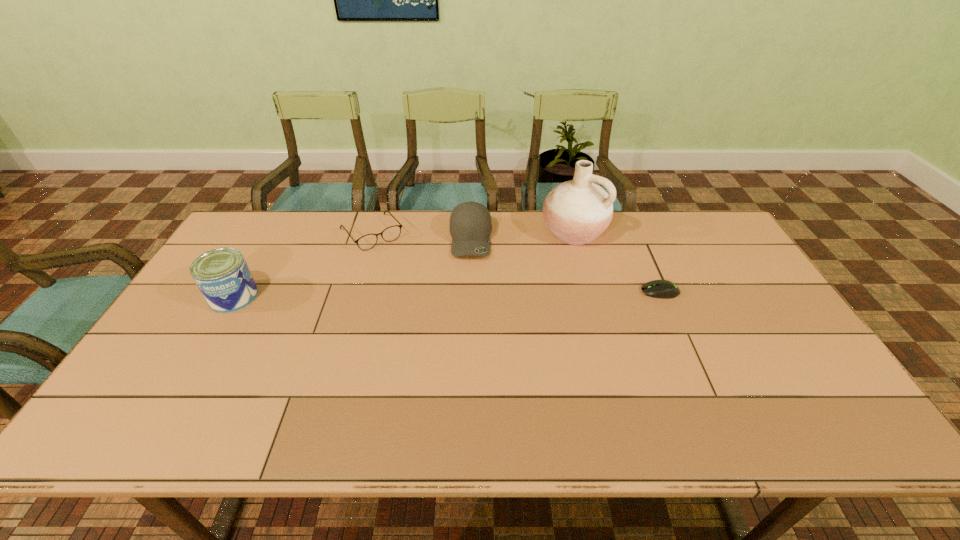
This screenshot has height=540, width=960. Find the location of `free spot located to pour from the handle of the fourth object from left to right`. free spot located to pour from the handle of the fourth object from left to right is located at coordinates (538, 265).

Identify the location of baseball cap positioned at the far edge. The width and height of the screenshot is (960, 540). (470, 224).

Identify the location of spectacles located at the far edge. (366, 242).

This screenshot has width=960, height=540. In order to click on pottery located at the far edge in this screenshot , I will do `click(578, 211)`.

The height and width of the screenshot is (540, 960). I want to click on object that is at the left edge, so click(x=222, y=275).

The height and width of the screenshot is (540, 960). In order to click on vacant position at the far edge of the desktop in this screenshot , I will do `click(635, 251)`.

What are the coordinates of `vacant region at the near edge of the desktop` in the screenshot? It's located at (468, 399).

Identify the location of vacant area at the left edge. Image resolution: width=960 pixels, height=540 pixels. (180, 321).

Locate an element on the screen. The image size is (960, 540). vacant space at the near right corner of the desktop is located at coordinates tap(812, 386).

Where is `vacant area that lies between the third object from right to left and the spectacles`? vacant area that lies between the third object from right to left and the spectacles is located at coordinates (421, 236).